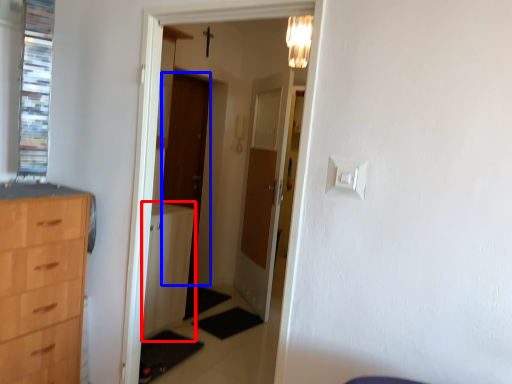
Question: Which object is closer to the camera taking this photo, file cabinet (highlighted by a red box) or door (highlighted by a blue box)?

Choices:
 (A) file cabinet
 (B) door

Answer: (A)